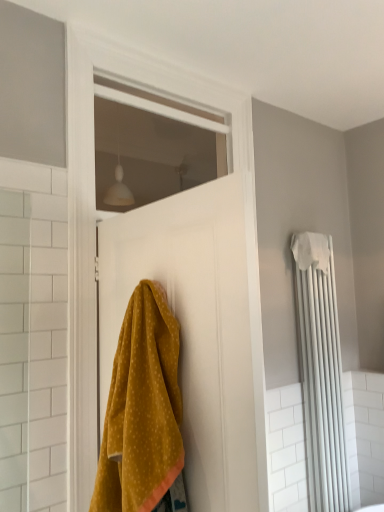
Question: Is white matte door at center smaller than white matte radiator at right?

Choices:
 (A) no
 (B) yes

Answer: (A)

Question: Considering the relative sizes of white matte door at center and white matte radiator at right in the image provided, is white matte door at center wider than white matte radiator at right?

Choices:
 (A) yes
 (B) no

Answer: (B)

Question: Can you confirm if white matte door at center is bigger than white matte radiator at right?

Choices:
 (A) yes
 (B) no

Answer: (A)

Question: From the image's perspective, would you say white matte door at center is shown under white matte radiator at right?

Choices:
 (A) no
 (B) yes

Answer: (A)

Question: Could white matte radiator at right be considered to be inside white matte door at center?

Choices:
 (A) yes
 (B) no

Answer: (B)

Question: Considering the relative positions of white matte radiator at right and mustard yellow fabric at center in the image provided, is white matte radiator at right to the left or to the right of mustard yellow fabric at center?

Choices:
 (A) left
 (B) right

Answer: (B)

Question: Relative to mustard yellow fabric at center, is white matte radiator at right in front or behind?

Choices:
 (A) front
 (B) behind

Answer: (B)

Question: From a real-world perspective, is white matte radiator at right positioned above or below mustard yellow fabric at center?

Choices:
 (A) below
 (B) above

Answer: (A)

Question: Do you think white matte radiator at right is within mustard yellow fabric at center, or outside of it?

Choices:
 (A) inside
 (B) outside

Answer: (B)

Question: Is point (114, 493) closer or farther from the camera than point (84, 332)?

Choices:
 (A) closer
 (B) farther

Answer: (A)

Question: Looking at their shapes, would you say mustard yellow fabric at center is wider or thinner than white matte door at center?

Choices:
 (A) thin
 (B) wide

Answer: (B)

Question: From a real-world perspective, is mustard yellow fabric at center positioned above or below white matte door at center?

Choices:
 (A) below
 (B) above

Answer: (A)

Question: Is mustard yellow fabric at center bigger or smaller than white matte door at center?

Choices:
 (A) big
 (B) small

Answer: (B)

Question: In the image, is white fabric bath towel at right on the left side or the right side of mustard yellow fabric at center?

Choices:
 (A) left
 (B) right

Answer: (B)

Question: In terms of height, does white fabric bath towel at right look taller or shorter compared to mustard yellow fabric at center?

Choices:
 (A) tall
 (B) short

Answer: (B)